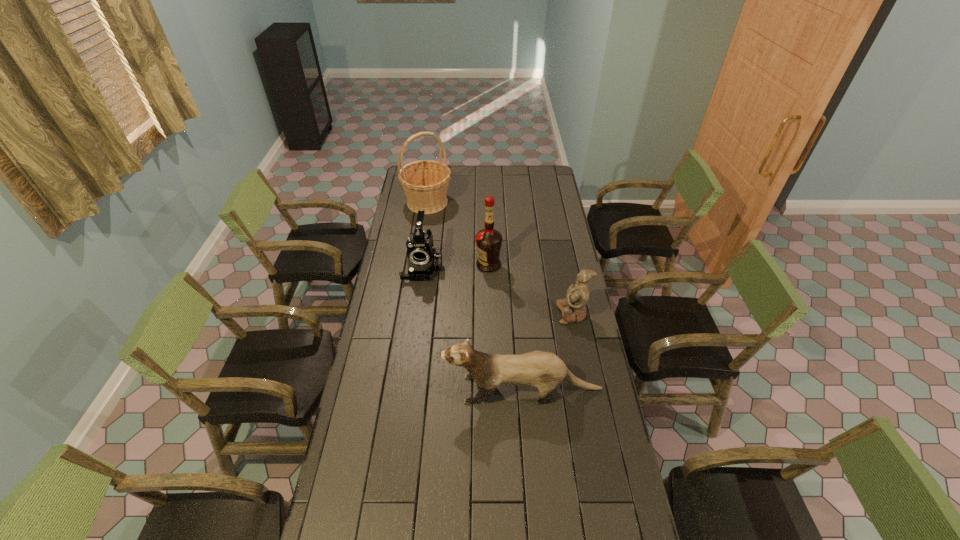
Locate which object is the third closest to the liquor. Please provide its 2D coordinates. Your answer should be formatted as a tuple, i.e. [(x, y)], where the tuple contains the x and y coordinates of a point satisfying the conditions above.

[(425, 182)]

Find the location of a particular element. This screenshot has width=960, height=540. vacant position in the image that satisfies the following two spatial constraints: 1. on the front and back of the liquor; 2. on the lens mount of the camcorder is located at coordinates (489, 267).